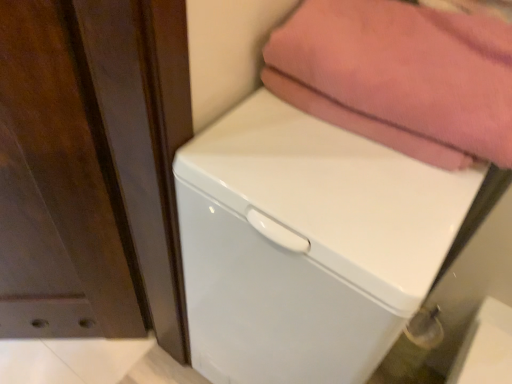
This screenshot has height=384, width=512. What do you see at coordinates (306, 245) in the screenshot?
I see `white glossy dishwasher at center` at bounding box center [306, 245].

What is the approximate width of white glossy dishwasher at center?

22.87 inches.

Where is `white glossy dishwasher at center`? white glossy dishwasher at center is located at coordinates (306, 245).

You are a GUI agent. You are given a task and a screenshot of the screen. Output one action in this format:
    pyautogui.click(x=<x>, y=<y>)
    Task: Click on the pink cotton towel at upper right
    
    Given the screenshot: What is the action you would take?
    pyautogui.click(x=399, y=77)

What do you see at coordinates (399, 77) in the screenshot?
I see `pink cotton towel at upper right` at bounding box center [399, 77].

In order to click on white glossy dishwasher at center in this screenshot , I will do `click(306, 245)`.

Does white glossy dishwasher at center appear on the left side of pink cotton towel at upper right?

Indeed, white glossy dishwasher at center is positioned on the left side of pink cotton towel at upper right.

Which object is closer to the camera, white glossy dishwasher at center or pink cotton towel at upper right?

white glossy dishwasher at center is in front.

Which is behind, point (434, 185) or point (295, 82)?

The point (295, 82) is farther from the camera.

From the image's perspective, would you say white glossy dishwasher at center is shown under pink cotton towel at upper right?

Yes, from the image's perspective, white glossy dishwasher at center is below pink cotton towel at upper right.

From a real-world perspective, is white glossy dishwasher at center located higher than pink cotton towel at upper right?

No, from a real-world perspective, white glossy dishwasher at center is not over pink cotton towel at upper right

Considering the relative sizes of white glossy dishwasher at center and pink cotton towel at upper right in the image provided, is white glossy dishwasher at center thinner than pink cotton towel at upper right?

In fact, white glossy dishwasher at center might be wider than pink cotton towel at upper right.

From the picture: In terms of height, does white glossy dishwasher at center look taller or shorter compared to pink cotton towel at upper right?

Considering their sizes, white glossy dishwasher at center has more height than pink cotton towel at upper right.

Is white glossy dishwasher at center smaller than pink cotton towel at upper right?

Incorrect, white glossy dishwasher at center is not smaller in size than pink cotton towel at upper right.

Is white glossy dishwasher at center completely or partially outside of pink cotton towel at upper right?

Yes.

In the scene shown: Is the surface of white glossy dishwasher at center in direct contact with pink cotton towel at upper right?

No, white glossy dishwasher at center is not next to pink cotton towel at upper right.

Is pink cotton towel at upper right at the back of white glossy dishwasher at center?

No, pink cotton towel at upper right is not at the back of white glossy dishwasher at center.

Measure the distance between white glossy dishwasher at center and pink cotton towel at upper right.

The distance of white glossy dishwasher at center from pink cotton towel at upper right is 6.96 inches.

Where is `towel behind the white glossy dishwasher at center`? Image resolution: width=512 pixels, height=384 pixels. towel behind the white glossy dishwasher at center is located at coordinates (399, 77).

Visually, is pink cotton towel at upper right positioned to the left or to the right of white glossy dishwasher at center?

Clearly, pink cotton towel at upper right is on the right of white glossy dishwasher at center in the image.

Which object is closer to the camera taking this photo, pink cotton towel at upper right or white glossy dishwasher at center?

white glossy dishwasher at center is in front.

Considering the points (323, 7) and (332, 198), which point is in front, point (323, 7) or point (332, 198)?

The point (332, 198) is closer.

From the image's perspective, relative to white glossy dishwasher at center, is pink cotton towel at upper right above or below?

From the image's perspective, pink cotton towel at upper right appears above white glossy dishwasher at center.

From a real-world perspective, is pink cotton towel at upper right beneath white glossy dishwasher at center?

Incorrect, from a real-world perspective, pink cotton towel at upper right is higher than white glossy dishwasher at center.

Is pink cotton towel at upper right wider or thinner than white glossy dishwasher at center?

pink cotton towel at upper right is thinner than white glossy dishwasher at center.

Based on the photo, in terms of height, does pink cotton towel at upper right look taller or shorter compared to white glossy dishwasher at center?

Clearly, pink cotton towel at upper right is shorter compared to white glossy dishwasher at center.

Can you confirm if pink cotton towel at upper right is smaller than white glossy dishwasher at center?

Correct, pink cotton towel at upper right occupies less space than white glossy dishwasher at center.

Is pink cotton towel at upper right not inside white glossy dishwasher at center?

pink cotton towel at upper right lies outside white glossy dishwasher at center's area.

Consider the image. Is there a large distance between pink cotton towel at upper right and white glossy dishwasher at center?

That's not correct — pink cotton towel at upper right is a little close to white glossy dishwasher at center.

Is pink cotton towel at upper right looking in the opposite direction of white glossy dishwasher at center?

pink cotton towel at upper right is not turned away from white glossy dishwasher at center.

How many degrees apart are the facing directions of pink cotton towel at upper right and white glossy dishwasher at center?

pink cotton towel at upper right and white glossy dishwasher at center are facing 0.29 degrees away from each other.

At what (x,y) coordinates should I click in order to perform the action: click on dish washer on the left side of pink cotton towel at upper right. Please return your answer as a coordinate pair (x, y). Image resolution: width=512 pixels, height=384 pixels. Looking at the image, I should click on 306,245.

Where is `towel lying behind the white glossy dishwasher at center`? towel lying behind the white glossy dishwasher at center is located at coordinates (399, 77).

Where is `towel lying on the right of white glossy dishwasher at center`? The height and width of the screenshot is (384, 512). towel lying on the right of white glossy dishwasher at center is located at coordinates (399, 77).